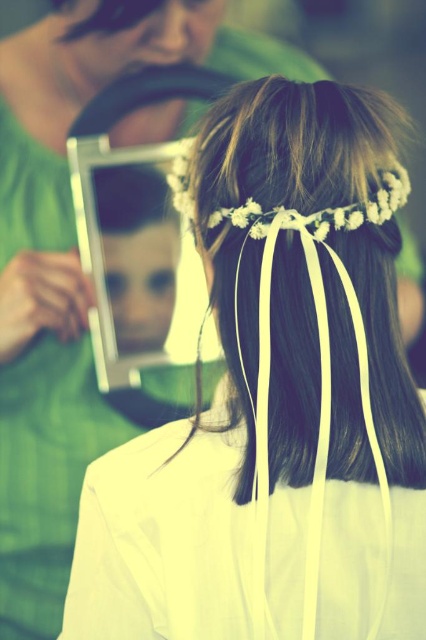
Is metallic silver frame at upper center further to camera compared to silky brown hair at upper center?

Yes, it is behind silky brown hair at upper center.

Who is positioned more to the left, metallic silver frame at upper center or silky brown hair at upper center?

Positioned to the left is metallic silver frame at upper center.

The height and width of the screenshot is (640, 426). In order to click on metallic silver frame at upper center in this screenshot , I will do `click(65, 285)`.